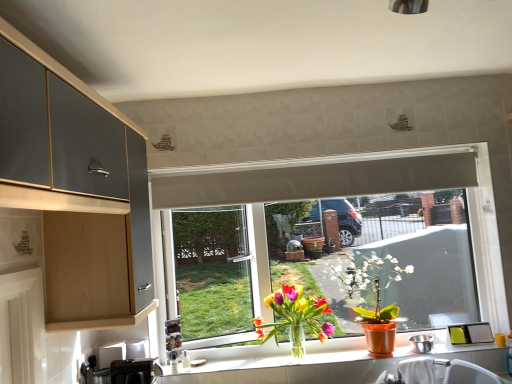
Question: From a real-world perspective, does black plastic toaster at lower left, which ranks as the 2th appliance in back-to-front order, sit lower than metallic stainless steel bowl at window, the first appliance from the back?

Choices:
 (A) yes
 (B) no

Answer: (B)

Question: Is black plastic toaster at lower left, the second appliance in the right-to-left sequence, further to camera compared to metallic stainless steel bowl at window, which appears as the second appliance when viewed from the left?

Choices:
 (A) no
 (B) yes

Answer: (A)

Question: Can you confirm if black plastic toaster at lower left, acting as the 1th appliance starting from the front, is bigger than metallic stainless steel bowl at window, which appears as the second appliance when viewed from the left?

Choices:
 (A) yes
 (B) no

Answer: (A)

Question: Does black plastic toaster at lower left, the second appliance in the right-to-left sequence, touch metallic stainless steel bowl at window, which appears as the second appliance when viewed from the left?

Choices:
 (A) yes
 (B) no

Answer: (B)

Question: Does black plastic toaster at lower left, acting as the first appliance starting from the left, lie in front of metallic stainless steel bowl at window, marked as the 2th appliance in a front-to-back arrangement?

Choices:
 (A) no
 (B) yes

Answer: (B)

Question: From the image's perspective, is black plastic toaster at lower left, acting as the 1th appliance starting from the front, over metallic stainless steel bowl at window, the first appliance from the back?

Choices:
 (A) yes
 (B) no

Answer: (B)

Question: Is translucent glass vase at window, acting as the 1th houseplant starting from the left, facing away from white matte exhaust hood at upper center?

Choices:
 (A) no
 (B) yes

Answer: (A)

Question: Could you tell me if translucent glass vase at window, acting as the 1th houseplant starting from the left, is turned towards white matte exhaust hood at upper center?

Choices:
 (A) no
 (B) yes

Answer: (A)

Question: From a real-world perspective, is translucent glass vase at window, the second houseplant in the right-to-left sequence, physically above white matte exhaust hood at upper center?

Choices:
 (A) yes
 (B) no

Answer: (B)

Question: Is the surface of translucent glass vase at window, the second houseplant in the right-to-left sequence, in direct contact with white matte exhaust hood at upper center?

Choices:
 (A) yes
 (B) no

Answer: (B)

Question: Is translucent glass vase at window, acting as the 1th houseplant starting from the left, to the left of white matte exhaust hood at upper center from the viewer's perspective?

Choices:
 (A) no
 (B) yes

Answer: (B)

Question: Does translucent glass vase at window, the second houseplant in the right-to-left sequence, contain white matte exhaust hood at upper center?

Choices:
 (A) no
 (B) yes

Answer: (A)

Question: From the image's perspective, would you say translucent glass vase at window, acting as the 1th houseplant starting from the left, is shown under translucent glass vase at lower center?

Choices:
 (A) no
 (B) yes

Answer: (A)